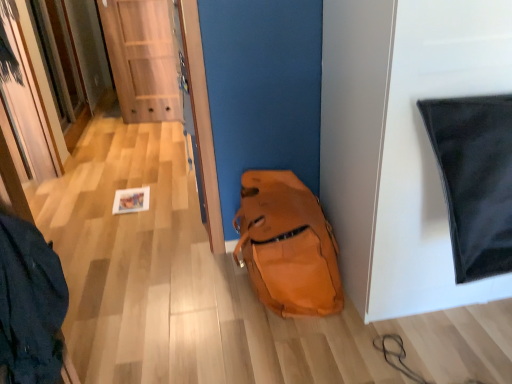
Locate an element on the screen. free area below wooden door at center (from a real-world perspective) is located at coordinates (153, 120).